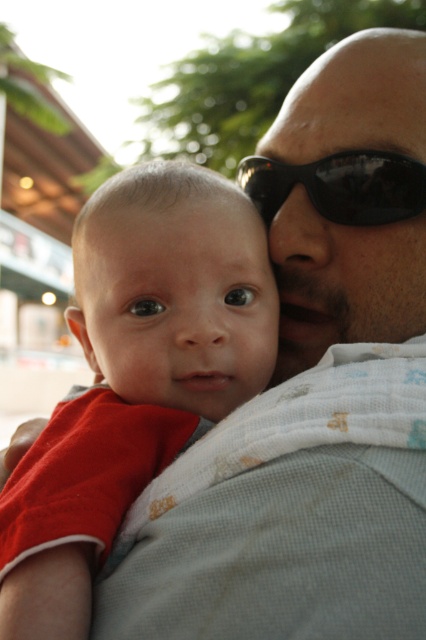
Question: Is the position of red cotton shirt at left less distant than that of black glossy sunglasses at center?

Choices:
 (A) no
 (B) yes

Answer: (B)

Question: Which point is closer to the camera?

Choices:
 (A) black glossy sunglasses at center
 (B) red cotton shirt at left

Answer: (B)

Question: Is red cotton shirt at left bigger than black glossy sunglasses at center?

Choices:
 (A) yes
 (B) no

Answer: (A)

Question: Can you confirm if red cotton shirt at left is thinner than black glossy sunglasses at center?

Choices:
 (A) yes
 (B) no

Answer: (B)